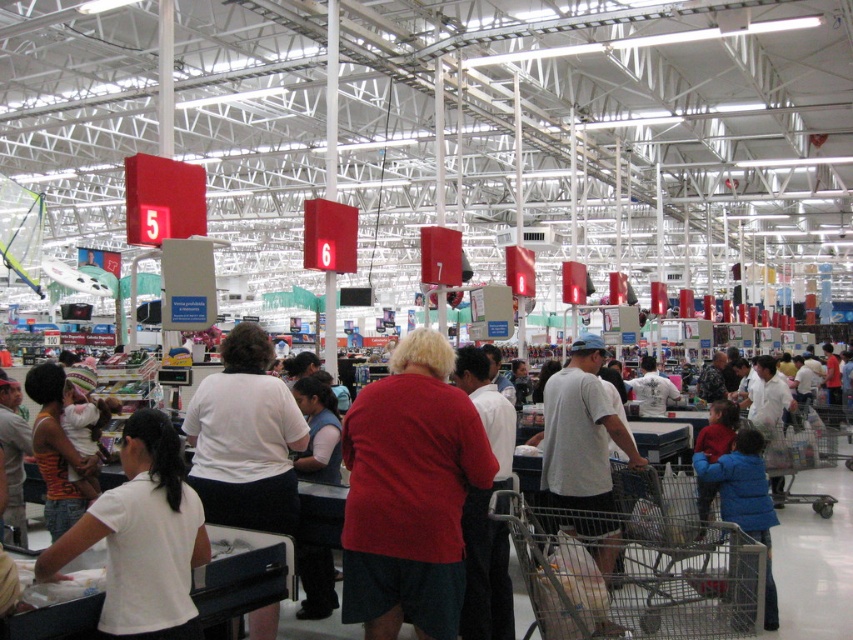
Does metallic silver shopping cart at lower right have a larger size compared to white cotton t-shirt at center?

Yes, metallic silver shopping cart at lower right is bigger than white cotton t-shirt at center.

Can you confirm if metallic silver shopping cart at lower right is smaller than white cotton t-shirt at center?

Actually, metallic silver shopping cart at lower right might be larger than white cotton t-shirt at center.

Is point (654, 596) farther from viewer compared to point (569, 506)?

No, (654, 596) is in front of (569, 506).

At what (x,y) coordinates should I click in order to perform the action: click on metallic silver shopping cart at lower right. Please return your answer as a coordinate pair (x, y). The height and width of the screenshot is (640, 853). Looking at the image, I should click on (635, 564).

Is point (131, 627) positioned in front of point (199, 486)?

Yes, point (131, 627) is in front of point (199, 486).

Does point (189, 486) come behind point (238, 433)?

No, (189, 486) is in front of (238, 433).

I want to click on white cotton shirt at lower left, so click(142, 538).

Is white matte shirt at center shorter than white cotton t-shirt at center?

Yes.

Which of these two, white matte shirt at center or white cotton t-shirt at center, stands shorter?

Standing shorter between the two is white matte shirt at center.

Identify the location of white matte shirt at center. The image size is (853, 640). (245, 438).

Identify the location of white matte shirt at center. The image size is (853, 640). (245, 438).